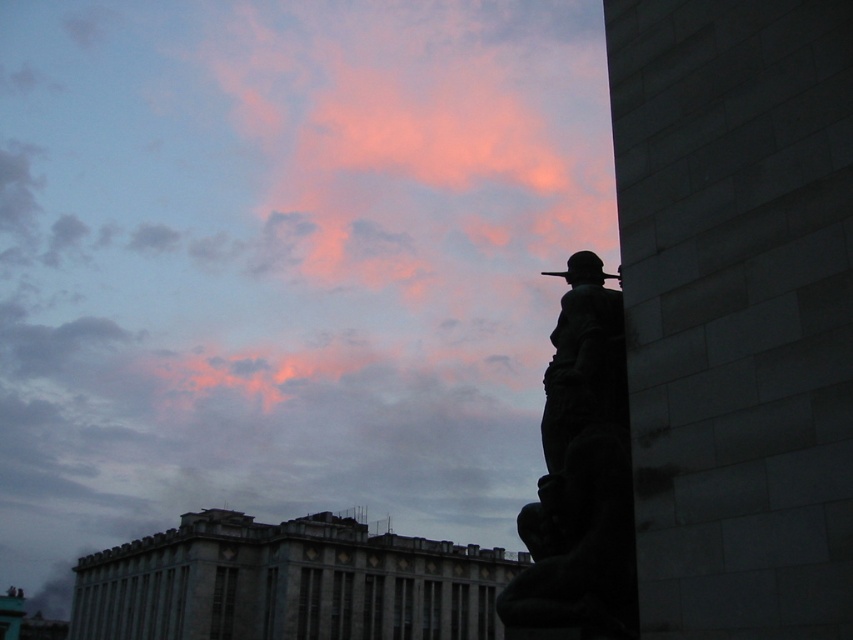
Question: Based on their relative distances, which object is nearer to the gray stone building at center?

Choices:
 (A) dark stone statue at right
 (B) pink cloud at upper center
 (C) white stone pillar at right

Answer: (A)

Question: Which of the following is the farthest from the observer?

Choices:
 (A) (202, 515)
 (B) (4, 301)
 (C) (804, 61)
 (D) (604, 291)

Answer: (B)

Question: Does pink cloud at upper center have a smaller size compared to white stone pillar at right?

Choices:
 (A) yes
 (B) no

Answer: (B)

Question: Can you confirm if gray stone building at center is positioned to the right of dark stone statue at right?

Choices:
 (A) yes
 (B) no

Answer: (B)

Question: Considering the real-world distances, which object is closest to the white stone pillar at right?

Choices:
 (A) pink cloud at upper center
 (B) gray stone building at center
 (C) dark stone statue at right

Answer: (C)

Question: Is white stone pillar at right below gray stone building at center?

Choices:
 (A) no
 (B) yes

Answer: (A)